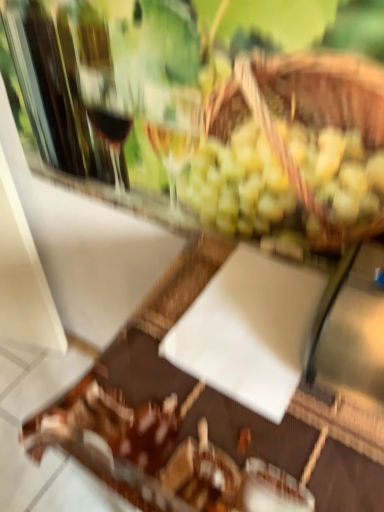
The width and height of the screenshot is (384, 512). Find the location of `matte glass wine glass at upper center`. matte glass wine glass at upper center is located at coordinates (200, 113).

Measure the distance between matte glass wine glass at upper center and camera.

They are 20.62 inches apart.

This screenshot has height=512, width=384. What do you see at coordinates (200, 113) in the screenshot?
I see `matte glass wine glass at upper center` at bounding box center [200, 113].

Locate an element on the screen. The height and width of the screenshot is (512, 384). white matte cutting board at center is located at coordinates (218, 407).

Describe the element at coordinates (218, 407) in the screenshot. The height and width of the screenshot is (512, 384). I see `white matte cutting board at center` at that location.

This screenshot has height=512, width=384. Identify the location of matte glass wine glass at upper center. (200, 113).

Based on the photo, in the image, is matte glass wine glass at upper center on the left side or the right side of white matte cutting board at center?

matte glass wine glass at upper center is to the left of white matte cutting board at center.

Which object is closer to the camera taking this photo, matte glass wine glass at upper center or white matte cutting board at center?

white matte cutting board at center is more forward.

Is point (170, 71) more distant than point (273, 462)?

Yes, point (170, 71) is behind point (273, 462).

From the image's perspective, would you say matte glass wine glass at upper center is shown under white matte cutting board at center?

No, from the image's perspective, matte glass wine glass at upper center is not below white matte cutting board at center.

From a real-world perspective, is matte glass wine glass at upper center on top of white matte cutting board at center?

Yes.

Does matte glass wine glass at upper center have a greater width compared to white matte cutting board at center?

No.

Which of these two, matte glass wine glass at upper center or white matte cutting board at center, stands shorter?

matte glass wine glass at upper center is shorter.

Who is bigger, matte glass wine glass at upper center or white matte cutting board at center?

white matte cutting board at center is bigger.

Is matte glass wine glass at upper center positioned beyond the bounds of white matte cutting board at center?

Absolutely, matte glass wine glass at upper center is external to white matte cutting board at center.

Can you see matte glass wine glass at upper center touching white matte cutting board at center?

There is a gap between matte glass wine glass at upper center and white matte cutting board at center.

Is matte glass wine glass at upper center oriented towards white matte cutting board at center?

No, matte glass wine glass at upper center is not oriented towards white matte cutting board at center.

How different are the orientations of matte glass wine glass at upper center and white matte cutting board at center in degrees?

There is a 0.00643-degree angle between the facing directions of matte glass wine glass at upper center and white matte cutting board at center.

You are a GUI agent. You are given a task and a screenshot of the screen. Output one action in this format:
    pyautogui.click(x=<x>, y=<y>)
    Task: Click on the table that is in front of the matte glass wine glass at upper center
    Image resolution: width=384 pixels, height=512 pixels.
    Given the screenshot: What is the action you would take?
    coord(218,407)

Considering the positions of objects white matte cutting board at center and matte glass wine glass at upper center in the image provided, who is more to the left, white matte cutting board at center or matte glass wine glass at upper center?

matte glass wine glass at upper center.

In the image, is white matte cutting board at center positioned in front of or behind matte glass wine glass at upper center?

Clearly, white matte cutting board at center is in front of matte glass wine glass at upper center.

Is point (149, 347) positioned before point (164, 66)?

Yes, it is in front of point (164, 66).

From the image's perspective, is white matte cutting board at center on top of matte glass wine glass at upper center?

No, from the image's perspective, white matte cutting board at center is not above matte glass wine glass at upper center.

From a real-world perspective, which is physically above, white matte cutting board at center or matte glass wine glass at upper center?

In real-world perspective, matte glass wine glass at upper center is above.

Is white matte cutting board at center thinner than matte glass wine glass at upper center?

In fact, white matte cutting board at center might be wider than matte glass wine glass at upper center.

Is white matte cutting board at center taller than matte glass wine glass at upper center?

Indeed, white matte cutting board at center has a greater height compared to matte glass wine glass at upper center.

Considering the sizes of objects white matte cutting board at center and matte glass wine glass at upper center in the image provided, who is smaller, white matte cutting board at center or matte glass wine glass at upper center?

matte glass wine glass at upper center is smaller.

Could matte glass wine glass at upper center be considered to be inside white matte cutting board at center?

No, matte glass wine glass at upper center is not a part of white matte cutting board at center.

Are white matte cutting board at center and matte glass wine glass at upper center far apart?

No, white matte cutting board at center is in close proximity to matte glass wine glass at upper center.

Is white matte cutting board at center positioned with its back to matte glass wine glass at upper center?

white matte cutting board at center does not have its back to matte glass wine glass at upper center.

Identify the location of table below the matte glass wine glass at upper center (from a real-world perspective). (218, 407).

The height and width of the screenshot is (512, 384). In order to click on table on the right of matte glass wine glass at upper center in this screenshot , I will do `click(218, 407)`.

Identify the location of wine tasting above the white matte cutting board at center (from the image's perspective). (200, 113).